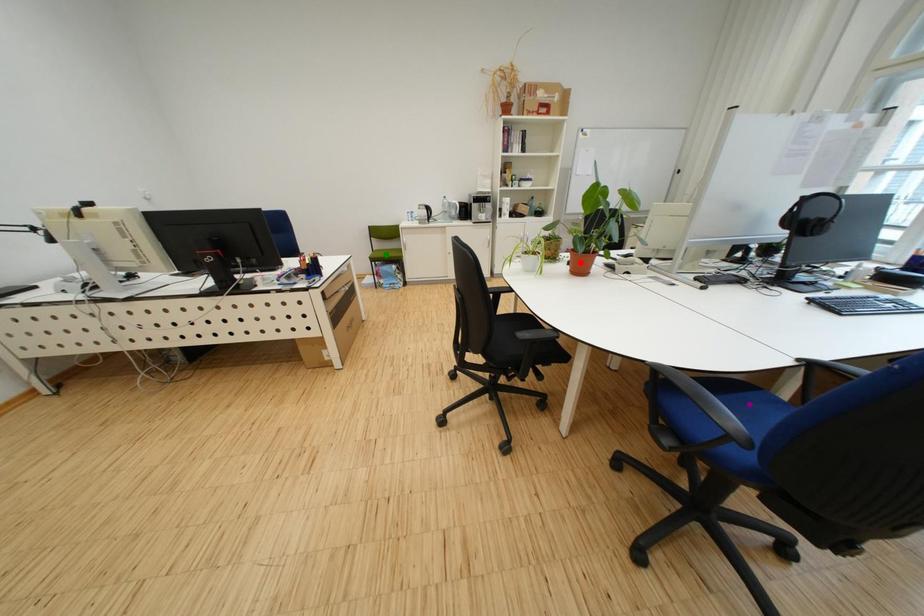
Order these from nearest to farthest:
red point, green point, purple point

purple point → red point → green point